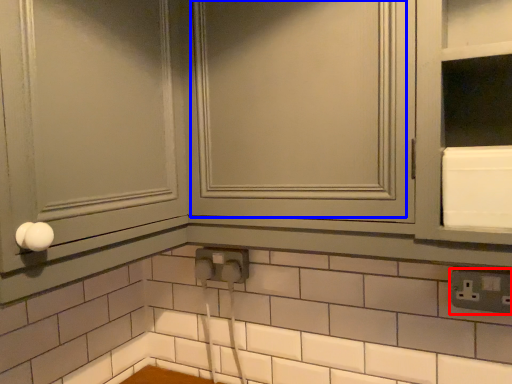
Question: Which object appears closest to the camera in this image, electric outlet (highlighted by a red box) or window (highlighted by a blue box)?

Choices:
 (A) electric outlet
 (B) window

Answer: (B)